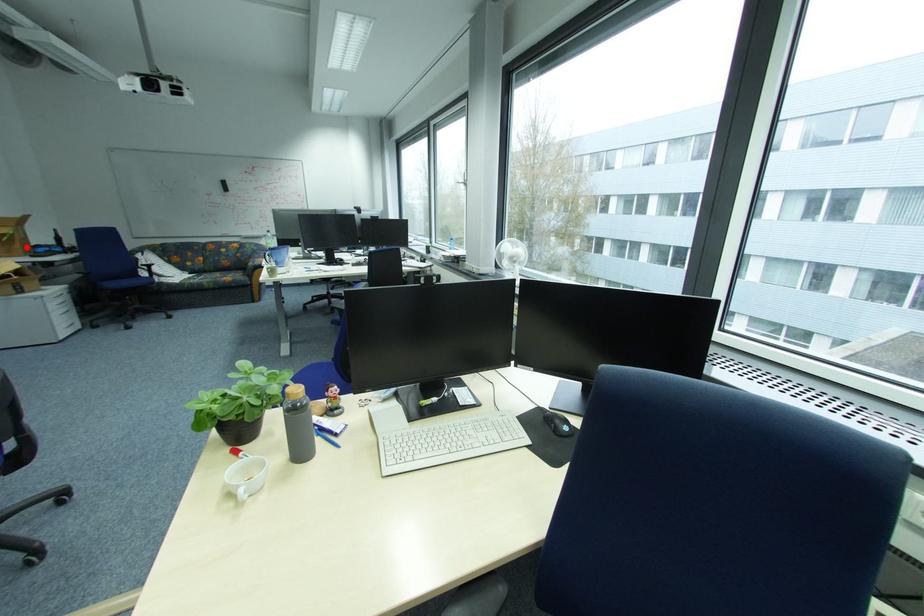
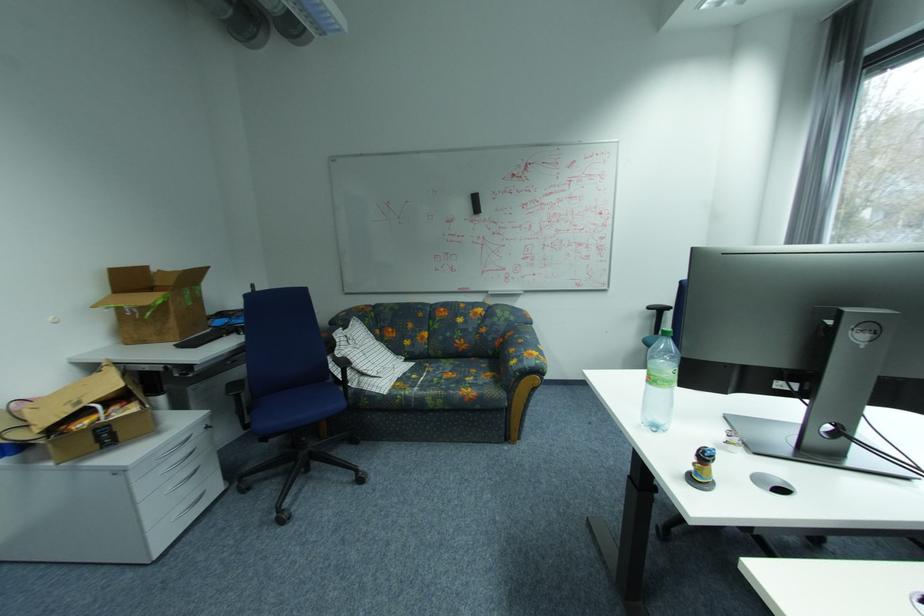
Find the pixel in the second image that matches the highlighted location in the first image.

(180, 323)